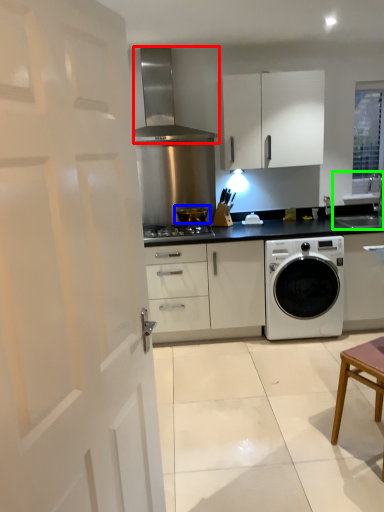
Question: Based on their relative distances, which object is nearer to home appliance (highlighted by a red box)? Choose from appliance (highlighted by a blue box) and sink (highlighted by a green box).

Choices:
 (A) appliance
 (B) sink

Answer: (A)